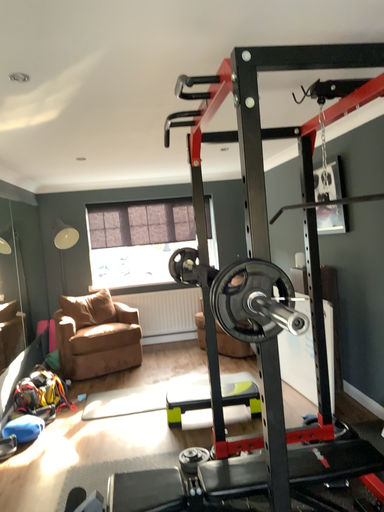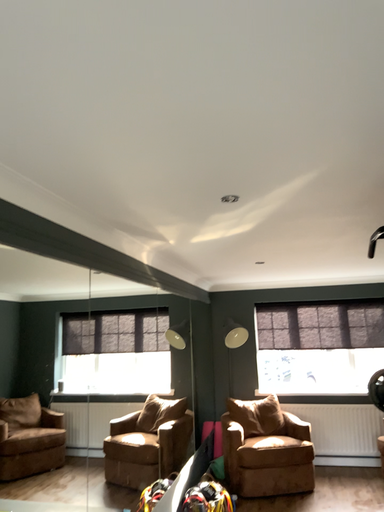
Question: How did the camera likely rotate when shooting the video?

Choices:
 (A) rotated downward
 (B) rotated upward

Answer: (B)